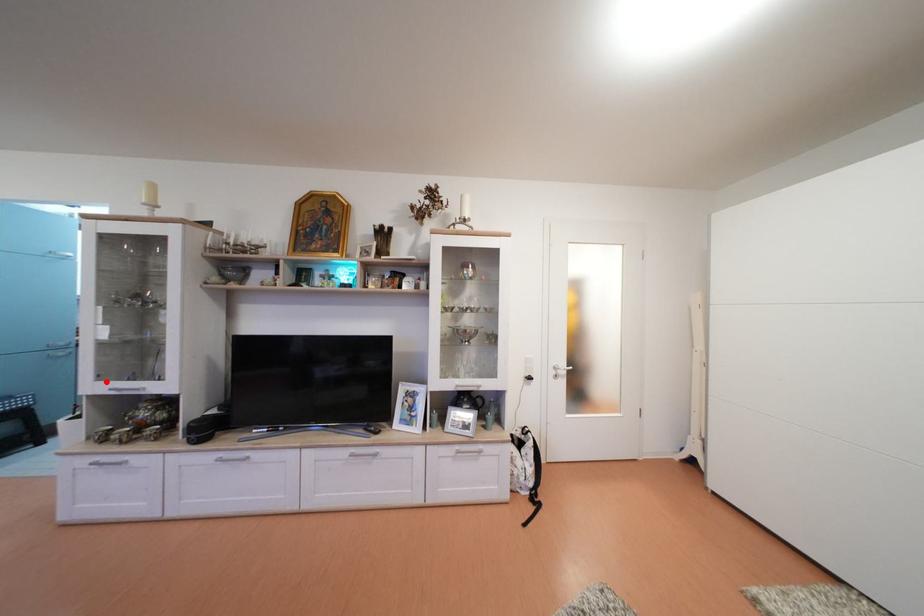
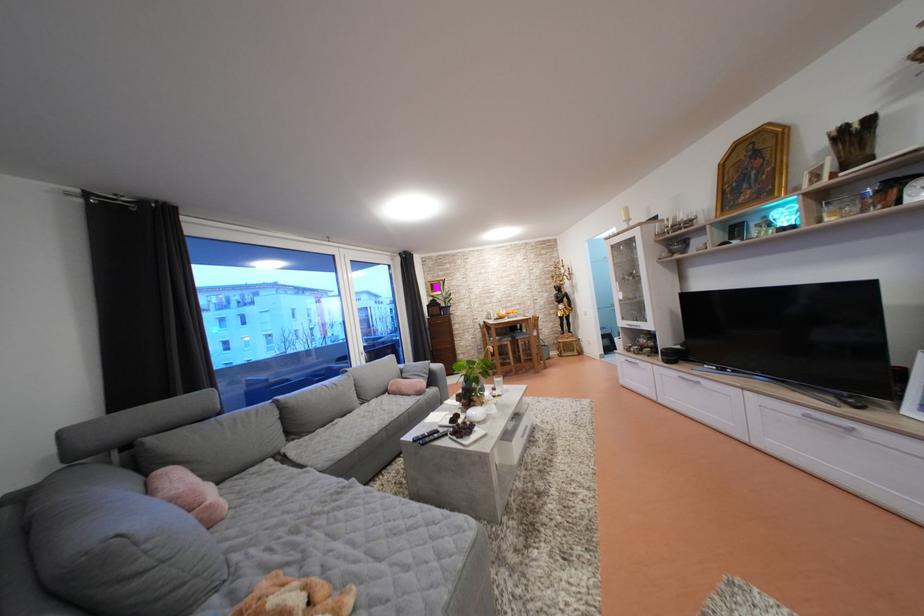
Locate, in the second image, the point that corresponds to the highlighted location in the first image.

(629, 323)